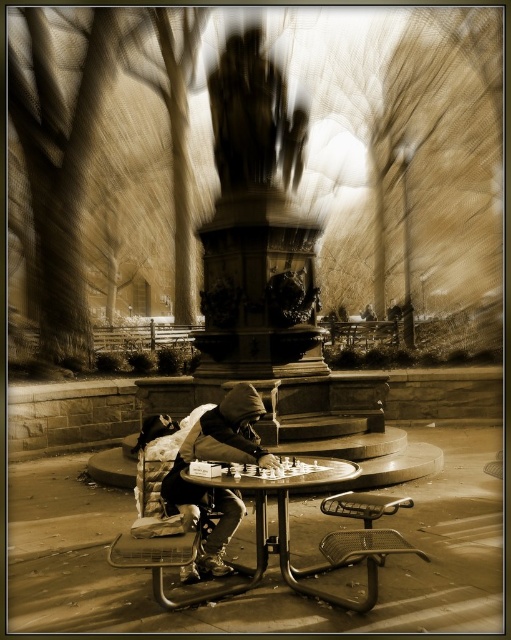
You are standing in the park and see the dark gray hoodie at center and the smooth wooden table at center. Which object is closer to you?

The dark gray hoodie at center is closer to you because it is further to the viewer than the smooth wooden table at center.

Looking at this image, you are standing at point (233, 588) and want to walk to point (211, 554). Is the destination point in front of or behind you?

The destination point (211, 554) is behind you because it is located behind point (233, 588) where you are standing.

You are a photographer trying to capture the dark gray hoodie at center and the smooth wooden table at center in a single frame. Based on their positions, which object should you adjust your camera to focus on first if you want to ensure both are in the frame?

The dark gray hoodie at center is to the left of the smooth wooden table at center, so you should focus on the smooth wooden table at center first to ensure both are within the frame.